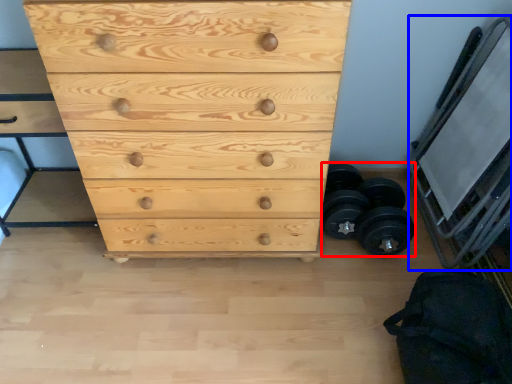
Question: Which point is further to the camera, dumbbell (highlighted by a red box) or bunk bed (highlighted by a blue box)?

Choices:
 (A) dumbbell
 (B) bunk bed

Answer: (A)